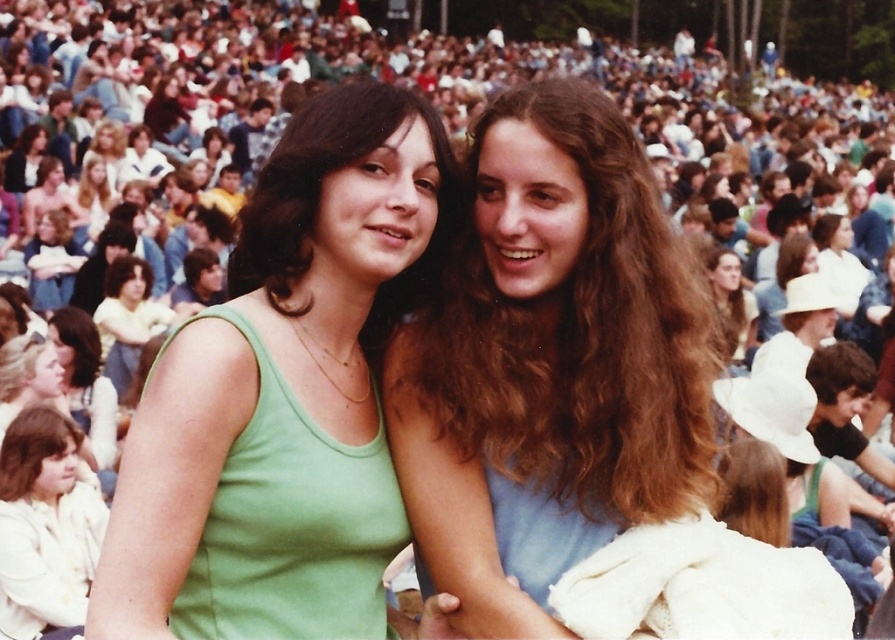
Question: Which is farther from the green fabric tank top at center?

Choices:
 (A) brown hair at upper center
 (B) light brown hair at center
 (C) green matte tank top at center

Answer: (A)

Question: Which is nearer to the white matte jacket at lower left?

Choices:
 (A) yellow fabric shirt at center
 (B) light brown hair at center

Answer: (B)

Question: Is light brown hair at center closer to camera compared to green fabric tank top at center?

Choices:
 (A) yes
 (B) no

Answer: (A)

Question: Does green fabric tank top at center appear over white matte jacket at lower left?

Choices:
 (A) yes
 (B) no

Answer: (A)

Question: Is light brown hair at center below green matte tank top at center?

Choices:
 (A) no
 (B) yes

Answer: (A)

Question: Estimate the real-world distances between objects in this image. Which object is closer to the brown hair at upper center?

Choices:
 (A) white matte jacket at lower left
 (B) yellow fabric shirt at center
 (C) green fabric tank top at center

Answer: (C)